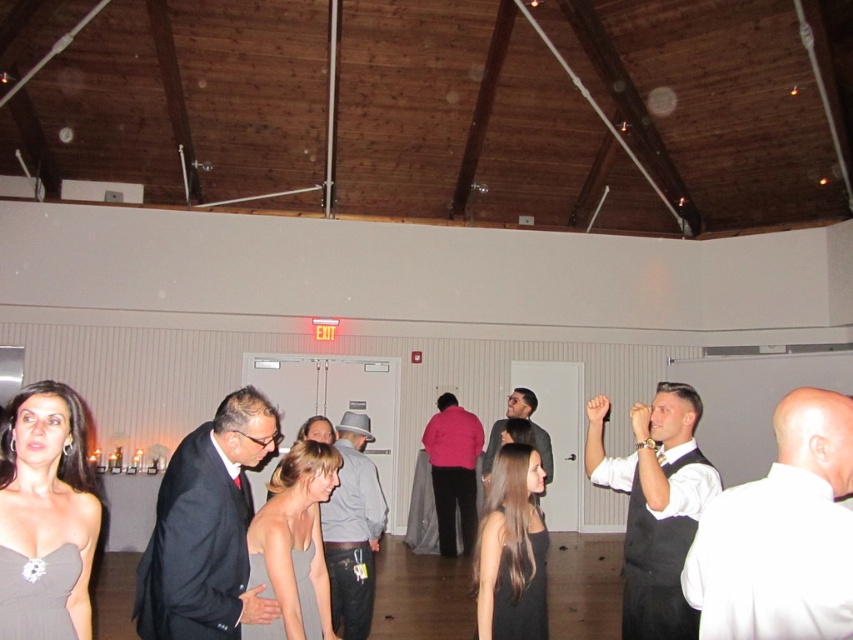
Question: Does matte black dress at center lie behind denim jeans at center?

Choices:
 (A) yes
 (B) no

Answer: (B)

Question: Is black satin suit at center thinner than matte black dress at center?

Choices:
 (A) yes
 (B) no

Answer: (B)

Question: Is denim jeans at center positioned before matte black dress at lower center?

Choices:
 (A) no
 (B) yes

Answer: (A)

Question: Which point appears farthest from the camera in this image?

Choices:
 (A) (746, 620)
 (B) (268, 637)

Answer: (B)

Question: Which point appears closest to the camera in this image?

Choices:
 (A) (666, 406)
 (B) (306, 429)

Answer: (A)

Question: Which point appears closest to the camera in this image?

Choices:
 (A) (241, 632)
 (B) (479, 426)

Answer: (A)